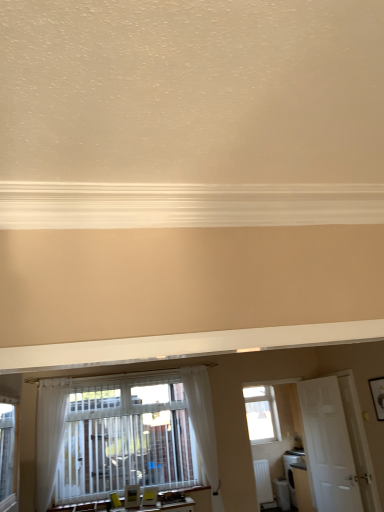
Question: From the image's perspective, is white plastic radiator at lower right positioned above or below clear glass window at center?

Choices:
 (A) below
 (B) above

Answer: (A)

Question: From a real-world perspective, relative to clear glass window at center, is white plastic radiator at lower right vertically above or below?

Choices:
 (A) above
 (B) below

Answer: (B)

Question: Estimate the real-world distances between objects in this image. Which object is farther from the clear glass window at center?

Choices:
 (A) white matte radiator at lower right
 (B) white wooden door at right
 (C) white sheer curtain at lower left, which is counted as the 2th curtain, starting from the right
 (D) white sheer curtain at center, the second curtain in the left-to-right sequence
 (E) white plastic radiator at lower right

Answer: (C)

Question: Considering the real-world distances, which object is closest to the clear glass window at center?

Choices:
 (A) white matte radiator at lower right
 (B) white sheer curtain at center, the second curtain in the left-to-right sequence
 (C) white plastic radiator at lower right
 (D) white wooden door at right
 (E) white sheer curtain at lower left, which is counted as the 2th curtain, starting from the right

Answer: (A)